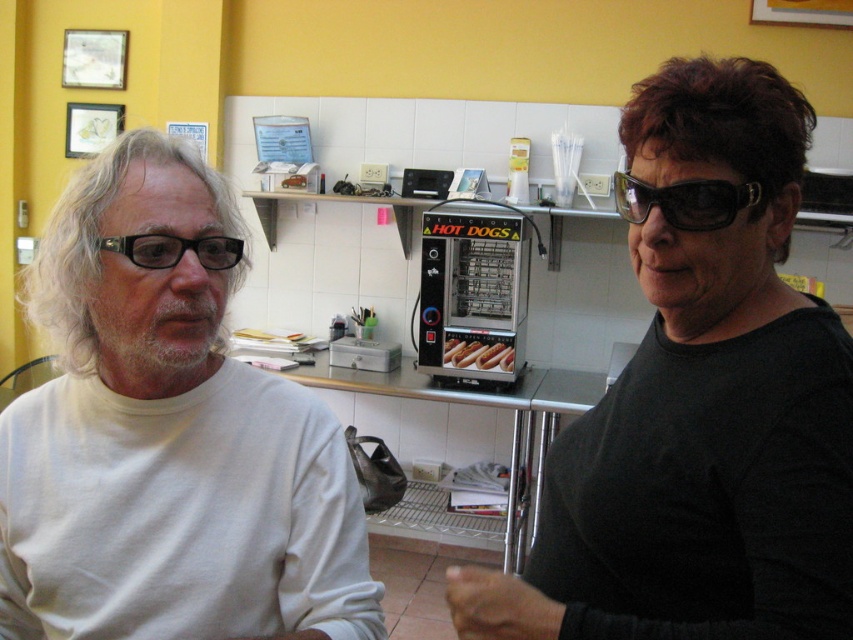
You are a customer at this cafe and you need to locate the black plastic glasses at left. According to the scene description, where exactly are they positioned?

The black plastic glasses at left are located at point (175,250).

You are a food delivery person who needs to deliver a hot dog bun to the table. You see the white matte shirt at left and the slightly toasted hot dog bun at center. Which object is closer to the ceiling?

The white matte shirt at left is above the slightly toasted hot dog bun at center, so the white matte shirt at left is closer to the ceiling.